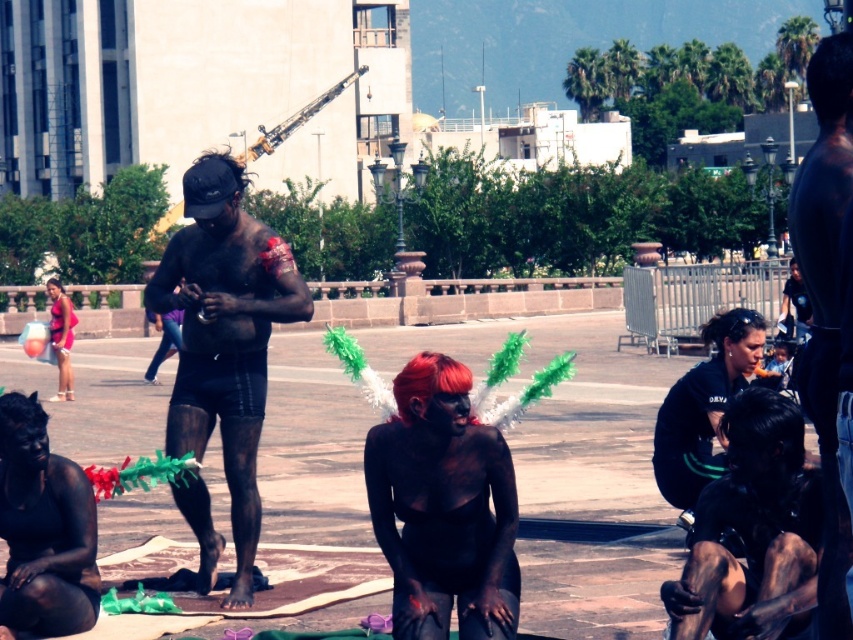
Between point (270, 305) and point (462, 586), which one is positioned behind?

Positioned behind is point (270, 305).

Is black matte shorts at center thinner than black matte body paint at center?

Incorrect, black matte shorts at center's width is not less than black matte body paint at center's.

Is point (236, 285) behind point (370, 460)?

Yes, point (236, 285) is farther from viewer.

Locate an element on the screen. Image resolution: width=853 pixels, height=640 pixels. black matte shorts at center is located at coordinates (225, 337).

Is black matte shorts at center below black matte uniform at center?

No.

Who is higher up, black matte shorts at center or black matte uniform at center?

black matte shorts at center

Locate an element on the screen. The image size is (853, 640). black matte shorts at center is located at coordinates (225, 337).

Does black matte shorts at center lie in front of black matte body paint at lower left?

That is False.

Which of these two, black matte shorts at center or black matte body paint at lower left, stands shorter?

black matte body paint at lower left

Is point (161, 300) in front of point (71, 556)?

No, it is behind (71, 556).

The width and height of the screenshot is (853, 640). I want to click on black matte shorts at center, so click(x=225, y=337).